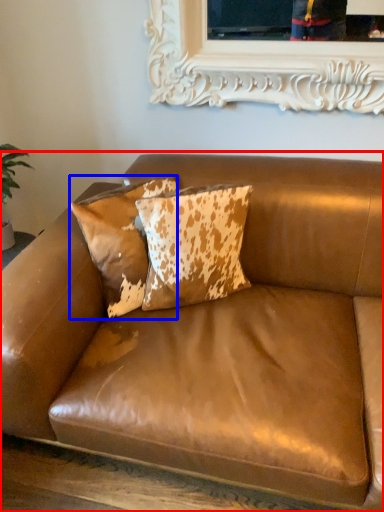
Question: Which object appears farthest to the camera in this image, studio couch (highlighted by a red box) or pillow (highlighted by a blue box)?

Choices:
 (A) studio couch
 (B) pillow

Answer: (B)